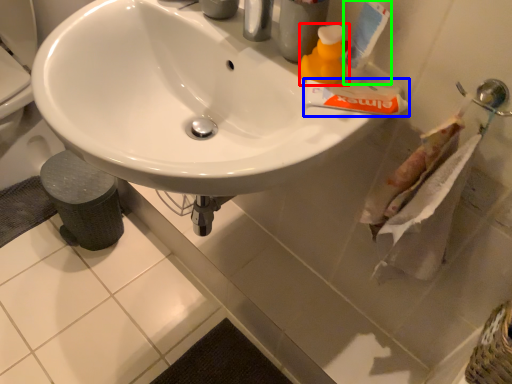
Question: Which is nearer to the cleaning product (highlighted by a red box)? toothpaste (highlighted by a blue box) or toothpaste (highlighted by a green box).

Choices:
 (A) toothpaste
 (B) toothpaste

Answer: (B)